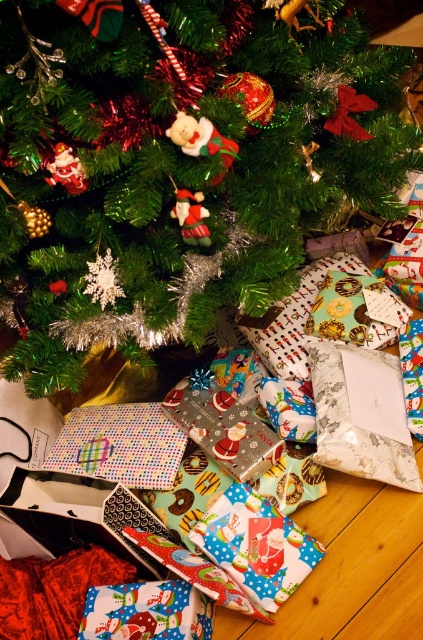
Question: Which object appears closest to the camera in this image?

Choices:
 (A) green matte christmas tree at center
 (B) santa-themed paper at lower center

Answer: (A)

Question: Can you confirm if santa-themed paper at lower center is thinner than printed fabric gift at lower left?

Choices:
 (A) yes
 (B) no

Answer: (B)

Question: Which object is the closest to the printed fabric gift at lower left?

Choices:
 (A) santa-themed paper at lower center
 (B) green matte christmas tree at center

Answer: (A)

Question: Does santa-themed paper at lower center have a lesser width compared to printed fabric gift at lower left?

Choices:
 (A) yes
 (B) no

Answer: (B)

Question: Is green matte christmas tree at center wider than santa-themed paper at lower center?

Choices:
 (A) yes
 (B) no

Answer: (A)

Question: Which of the following is the farthest from the observer?

Choices:
 (A) (208, 272)
 (B) (159, 600)

Answer: (B)